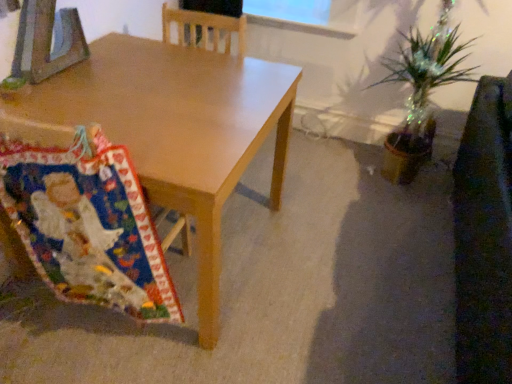
You are a GUI agent. You are given a task and a screenshot of the screen. Output one action in this format:
    pyautogui.click(x=<x>, y=<y>)
    Task: Click on the free space below multicolored fabric at lower left (from a real-world perspective)
    
    Given the screenshot: What is the action you would take?
    pyautogui.click(x=91, y=338)